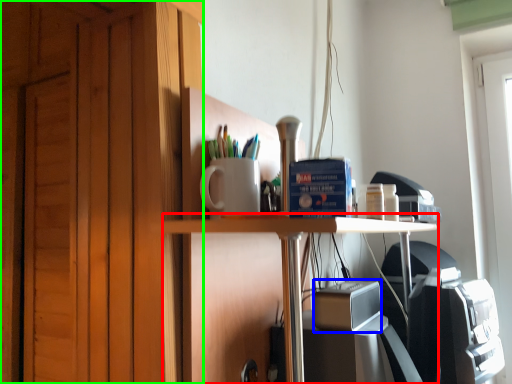
Question: Considering the real-world distances, which object is farthest from table (highlighted by a red box)? appliance (highlighted by a blue box) or dresser (highlighted by a green box)?

Choices:
 (A) appliance
 (B) dresser

Answer: (B)